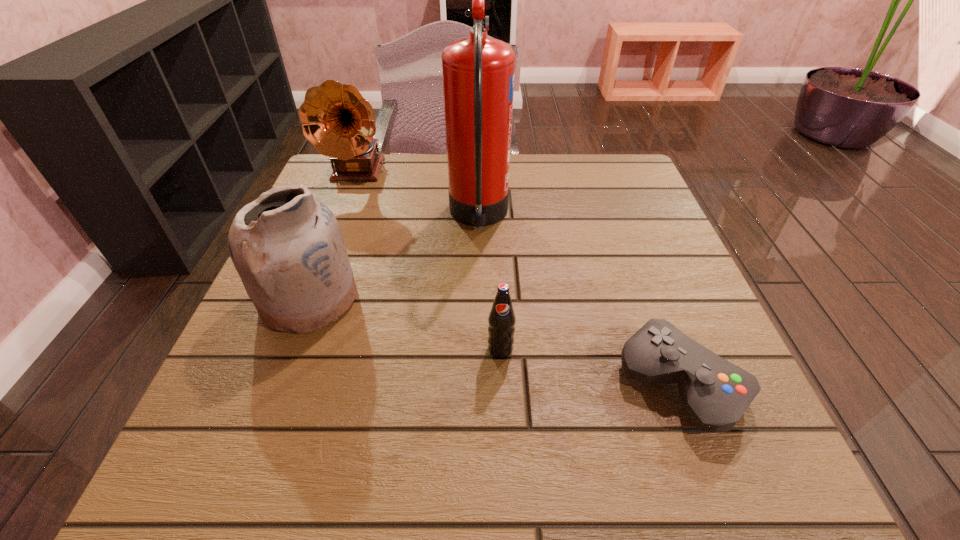
Identify the location of free space that satisfies the following two spatial constraints: 1. on the surface of the tallest object; 2. on the front side of the pottery. This screenshot has width=960, height=540. (478, 298).

Locate an element on the screen. free region that satisfies the following two spatial constraints: 1. on the front label of the rightmost object; 2. on the right side of the pop is located at coordinates (502, 383).